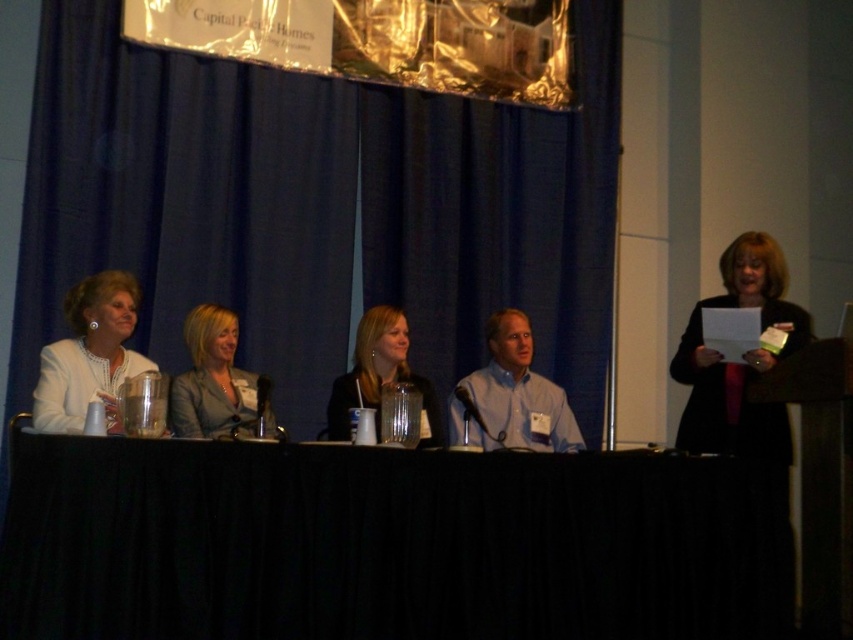
Which is below, black fabric table at center or light blue shirt at center?

black fabric table at center

Looking at this image, which is more to the right, black fabric table at center or light blue shirt at center?

light blue shirt at center is more to the right.

At what (x,y) coordinates should I click in order to perform the action: click on black fabric table at center. Please return your answer as a coordinate pair (x, y). Looking at the image, I should click on (387, 544).

Does black fabric table at center come behind white fabric jacket at left?

No.

Is black fabric table at center positioned before white fabric jacket at left?

Yes, black fabric table at center is in front of white fabric jacket at left.

The height and width of the screenshot is (640, 853). In order to click on black fabric table at center in this screenshot , I will do `click(387, 544)`.

Where is `black fabric table at center`? black fabric table at center is located at coordinates (387, 544).

Between matte gray blazer at center and smooth black jacket at center, which one is positioned lower?

matte gray blazer at center is lower down.

Who is positioned more to the right, matte gray blazer at center or smooth black jacket at center?

smooth black jacket at center

What do you see at coordinates (212, 380) in the screenshot?
I see `matte gray blazer at center` at bounding box center [212, 380].

You are a GUI agent. You are given a task and a screenshot of the screen. Output one action in this format:
    pyautogui.click(x=<x>, y=<y>)
    Task: Click on the matte gray blazer at center
    This screenshot has height=640, width=853.
    Given the screenshot: What is the action you would take?
    pyautogui.click(x=212, y=380)